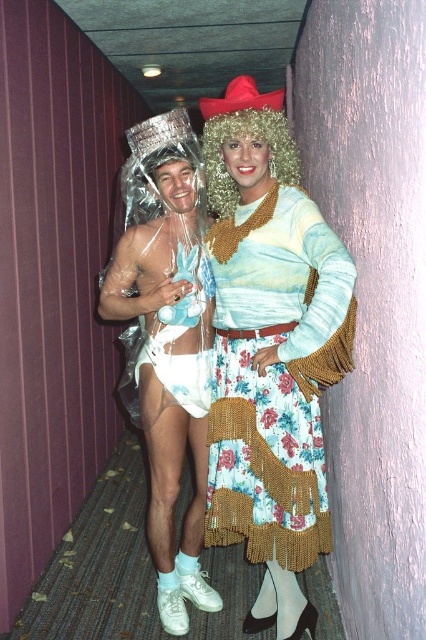
Is shiny plastic wrap at left smaller than fuzzy blonde wig at center?

Incorrect, shiny plastic wrap at left is not smaller in size than fuzzy blonde wig at center.

Does shiny plastic wrap at left appear on the right side of fuzzy blonde wig at center?

In fact, shiny plastic wrap at left is to the left of fuzzy blonde wig at center.

Is point (154, 173) farther from viewer compared to point (224, 170)?

Yes.

This screenshot has height=640, width=426. I want to click on shiny plastic wrap at left, so click(x=166, y=340).

Is shiny plastic wrap at left to the right of white sheer fabric at center from the viewer's perspective?

In fact, shiny plastic wrap at left is to the left of white sheer fabric at center.

Is shiny plastic wrap at left behind white sheer fabric at center?

No, shiny plastic wrap at left is closer to the viewer.

The width and height of the screenshot is (426, 640). Describe the element at coordinates (166, 340) in the screenshot. I see `shiny plastic wrap at left` at that location.

Find the location of a particular element. The width and height of the screenshot is (426, 640). shiny plastic wrap at left is located at coordinates (166, 340).

In the scene shown: Who is lower down, shiny plastic wrap at center or fuzzy blonde wig at center?

shiny plastic wrap at center

Is shiny plastic wrap at center smaller than fuzzy blonde wig at center?

No, shiny plastic wrap at center is not smaller than fuzzy blonde wig at center.

Locate an element on the screen. This screenshot has height=640, width=426. shiny plastic wrap at center is located at coordinates (270, 349).